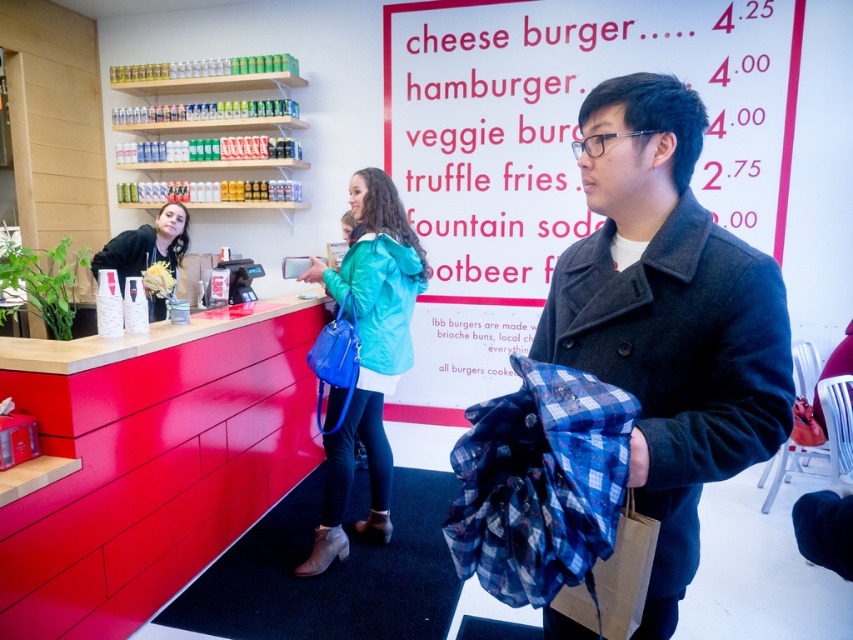
You are a delivery person who needs to place a package between the dark wool coat at center and the matte black hoodie at center. The package requires 8 feet of space. Is there enough space between them?

The dark wool coat at center is 9.10 feet from matte black hoodie at center, so yes, there is enough space to place the package between them since the distance is more than the required 8 feet.

You are taking a photo of the scene and want to focus on both the man holding the blue and white checkered garment and the woman near the counter. Which of these two points, point (x=640, y=189) or point (x=170, y=230), should you adjust your focus to first if you want to ensure the man is in focus before the woman?

Point (x=640, y=189) is closer to the camera than point (x=170, y=230), so you should focus on point (x=640, y=189) first to ensure the man is in focus before the woman.